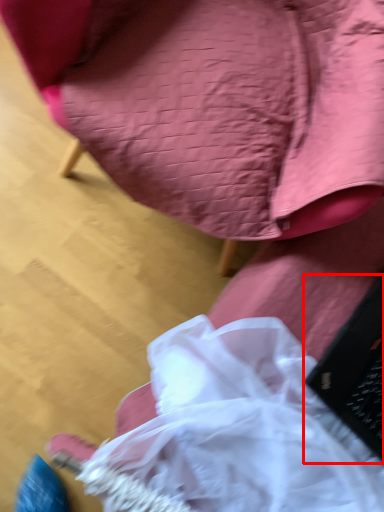
Question: From the image, what is the correct spatial relationship of laptop (annotated by the red box) in relation to chair?

Choices:
 (A) right
 (B) left

Answer: (A)